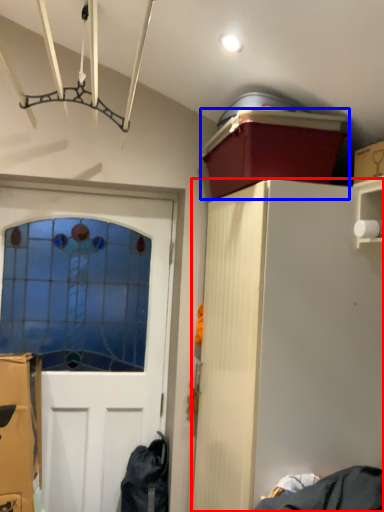
Question: Among these objects, which one is farthest to the camera, cabinetry (highlighted by a red box) or box (highlighted by a blue box)?

Choices:
 (A) cabinetry
 (B) box

Answer: (B)